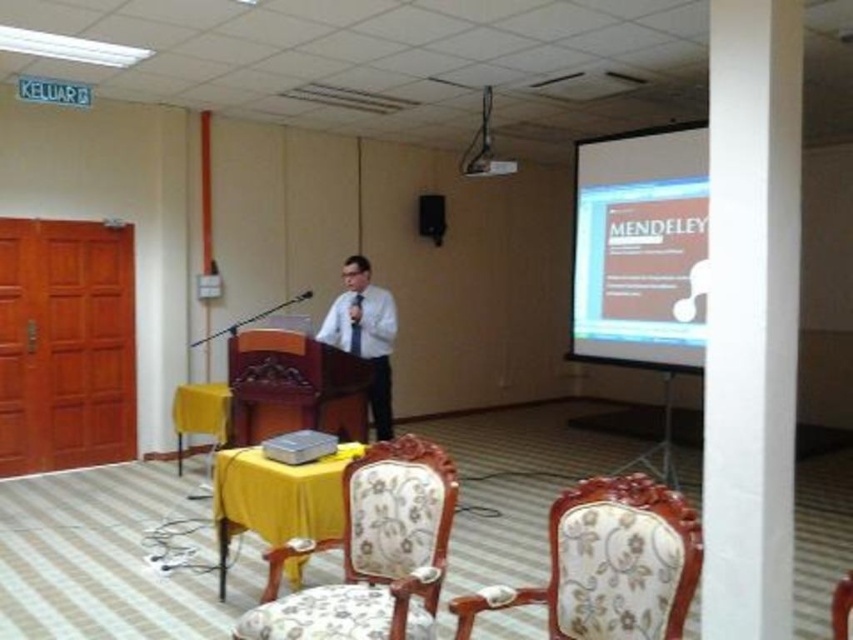
Question: Can you confirm if white matte projection screen at upper right is positioned above floral fabric armchair at center?

Choices:
 (A) yes
 (B) no

Answer: (A)

Question: Which of the following is the closest to the observer?

Choices:
 (A) black satin tie at center
 (B) black plastic projector at upper center

Answer: (A)

Question: Considering the real-world distances, which object is closest to the white smooth pillar at center right?

Choices:
 (A) white matte projection screen at upper right
 (B) black satin tie at center
 (C) white glossy shirt at center

Answer: (A)

Question: Does white smooth pillar at center right appear over matte black speaker at upper center?

Choices:
 (A) no
 (B) yes

Answer: (A)

Question: In this image, where is white smooth pillar at center right located relative to white glossy shirt at center?

Choices:
 (A) above
 (B) below

Answer: (A)

Question: Which of the following is the farthest from the observer?

Choices:
 (A) white matte projection screen at upper right
 (B) matte black speaker at upper center

Answer: (B)